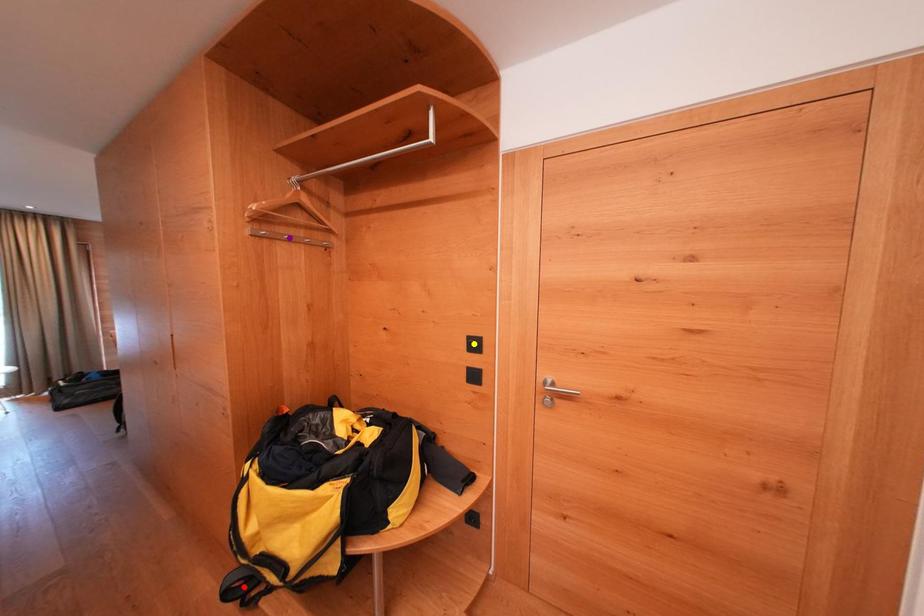
Order these from nearest to farthest:
- yellow point
- red point
- purple point

1. purple point
2. yellow point
3. red point